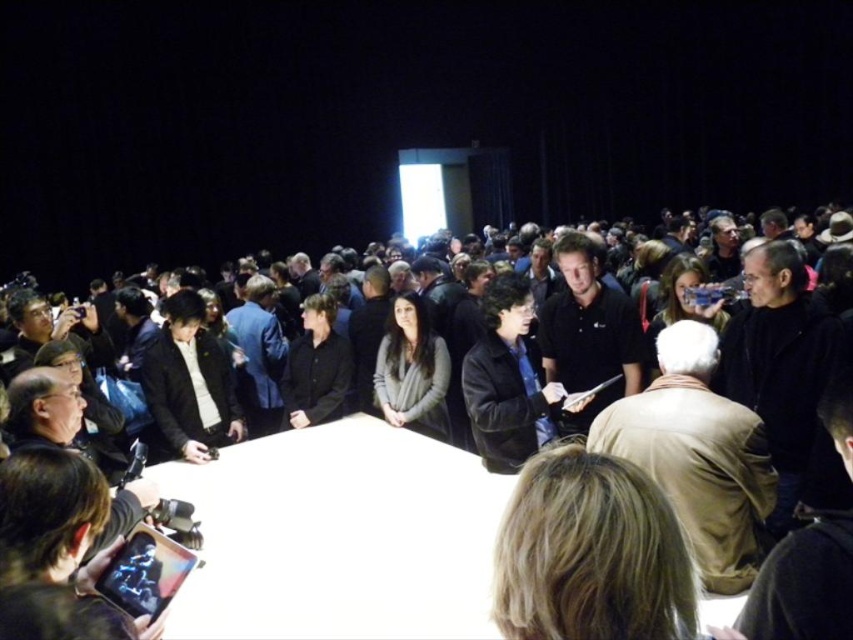
Does beige wool coat at center lie behind black matte shirt at center?

No, beige wool coat at center is closer to the viewer.

The width and height of the screenshot is (853, 640). Describe the element at coordinates (697, 456) in the screenshot. I see `beige wool coat at center` at that location.

Is point (743, 520) positioned before point (608, 314)?

Yes, point (743, 520) is closer to viewer.

This screenshot has height=640, width=853. Find the location of `beige wool coat at center`. beige wool coat at center is located at coordinates (697, 456).

Does white glossy table at center appear over blonde hair at lower center?

No, white glossy table at center is not above blonde hair at lower center.

Does white glossy table at center have a greater height compared to blonde hair at lower center?

Yes, white glossy table at center is taller than blonde hair at lower center.

Identify the location of white glossy table at center. (339, 536).

Is black matte shirt at center thinner than black matte jacket at center?

Incorrect, black matte shirt at center's width is not less than black matte jacket at center's.

Between black matte shirt at center and black matte jacket at center, which one has less height?

black matte jacket at center

In order to click on black matte shirt at center in this screenshot , I will do 589,333.

I want to click on black matte shirt at center, so click(589, 333).